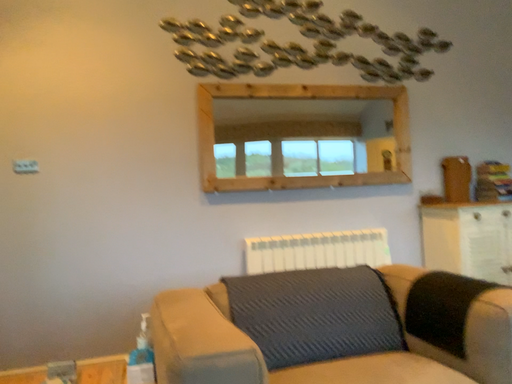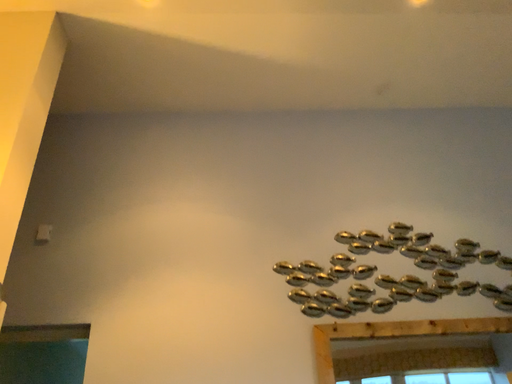
Question: Which way did the camera rotate in the video?

Choices:
 (A) rotated right
 (B) rotated left

Answer: (B)